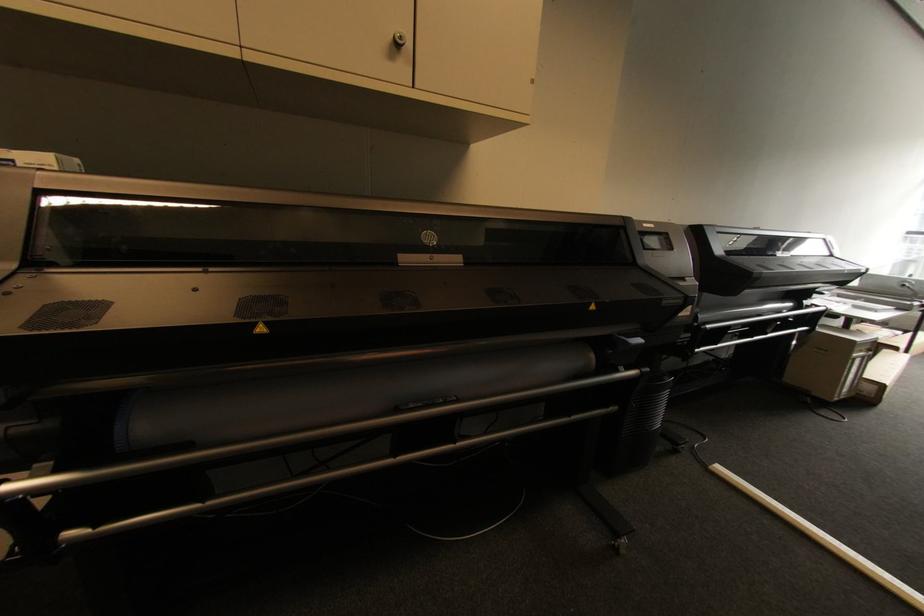
The image size is (924, 616). Describe the element at coordinates (782, 243) in the screenshot. I see `the small printer lid` at that location.